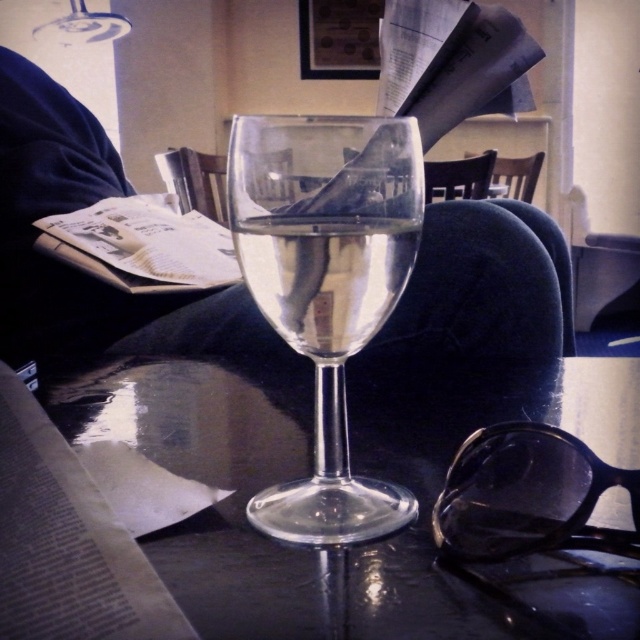
Does transparent glass wine glass at center have a greater height compared to transparent plastic goggles at lower right?

Indeed, transparent glass wine glass at center has a greater height compared to transparent plastic goggles at lower right.

Is transparent glass wine glass at center shorter than transparent plastic goggles at lower right?

In fact, transparent glass wine glass at center may be taller than transparent plastic goggles at lower right.

Is point (269, 300) less distant than point (552, 484)?

No, it is not.

Where is `transparent glass wine glass at center`? The height and width of the screenshot is (640, 640). transparent glass wine glass at center is located at coordinates (326, 288).

Between transparent glass table at center and transparent plastic goggles at lower right, which one has more height?

Standing taller between the two is transparent glass table at center.

Does transparent glass table at center appear over transparent plastic goggles at lower right?

Yes, transparent glass table at center is above transparent plastic goggles at lower right.

Locate an element on the screen. The width and height of the screenshot is (640, 640). transparent glass table at center is located at coordinates tap(273, 483).

Does transparent glass wine glass at center have a smaller size compared to clear glass wine at center?

No, transparent glass wine glass at center is not smaller than clear glass wine at center.

Which is behind, point (348, 476) or point (257, 232)?

The point (348, 476) is more distant.

Where is `transparent glass wine glass at center`? Image resolution: width=640 pixels, height=640 pixels. transparent glass wine glass at center is located at coordinates (326, 288).